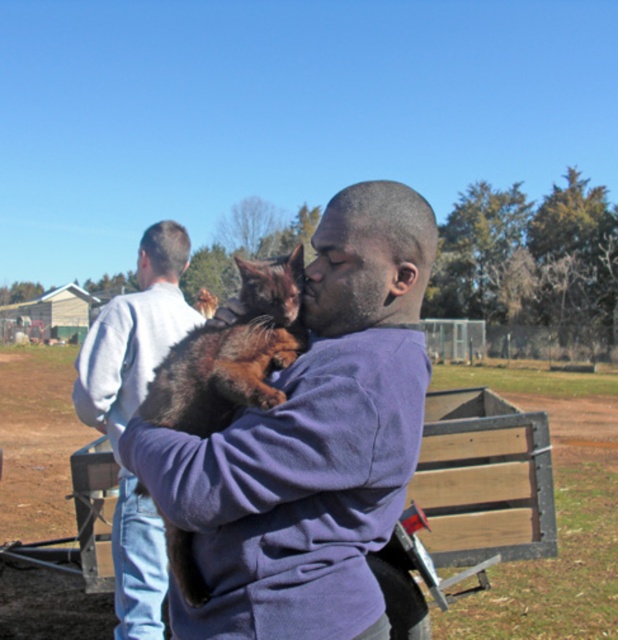
Question: Is brown furry cat at center to the right of light gray sweatshirt at left from the viewer's perspective?

Choices:
 (A) no
 (B) yes

Answer: (B)

Question: Is brown furry cat at center further to camera compared to light gray sweatshirt at left?

Choices:
 (A) yes
 (B) no

Answer: (B)

Question: Is brown furry cat at center positioned before light gray sweatshirt at left?

Choices:
 (A) no
 (B) yes

Answer: (B)